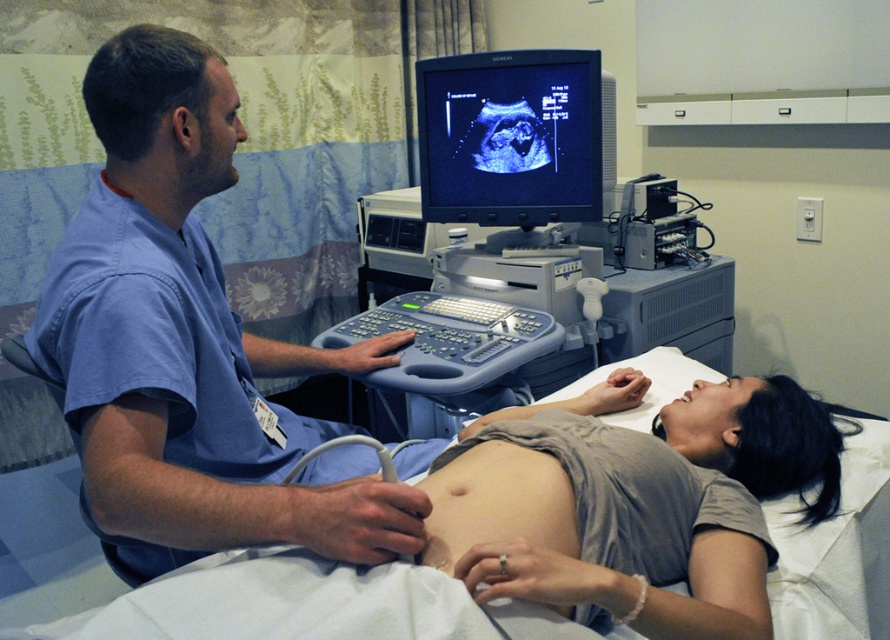
Who is taller, black glossy monitor at upper center or gray plastic ultrasound machine at center?

black glossy monitor at upper center

Can you confirm if black glossy monitor at upper center is smaller than gray plastic ultrasound machine at center?

Yes.

Who is more distant from viewer, (483, 72) or (403, 296)?

The point (403, 296) is more distant.

I want to click on black glossy monitor at upper center, so click(x=510, y=138).

How much distance is there between blue scrubs at center and white fabric hospital bed at center?

The distance of blue scrubs at center from white fabric hospital bed at center is 16.02 inches.

Is blue scrubs at center taller than white fabric hospital bed at center?

Yes, blue scrubs at center is taller than white fabric hospital bed at center.

This screenshot has height=640, width=890. Describe the element at coordinates (189, 344) in the screenshot. I see `blue scrubs at center` at that location.

Find the location of `blue scrubs at center`. blue scrubs at center is located at coordinates 189,344.

Is point (51, 346) positioned before point (576, 157)?

Yes, point (51, 346) is closer to viewer.

Measure the distance between point [89,102] and camera.

Point [89,102] and camera are 1.14 meters apart from each other.

Image resolution: width=890 pixels, height=640 pixels. I want to click on blue scrubs at center, so click(x=189, y=344).